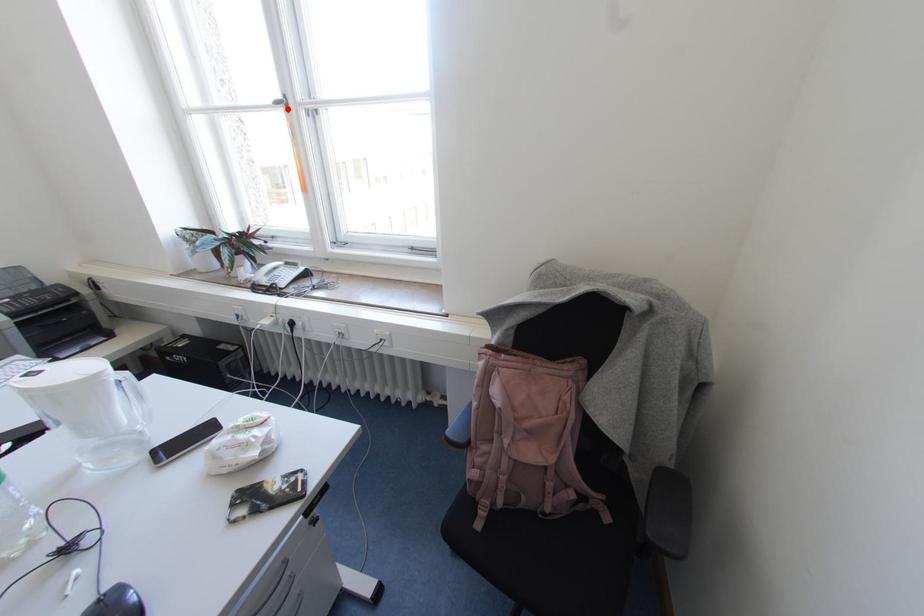
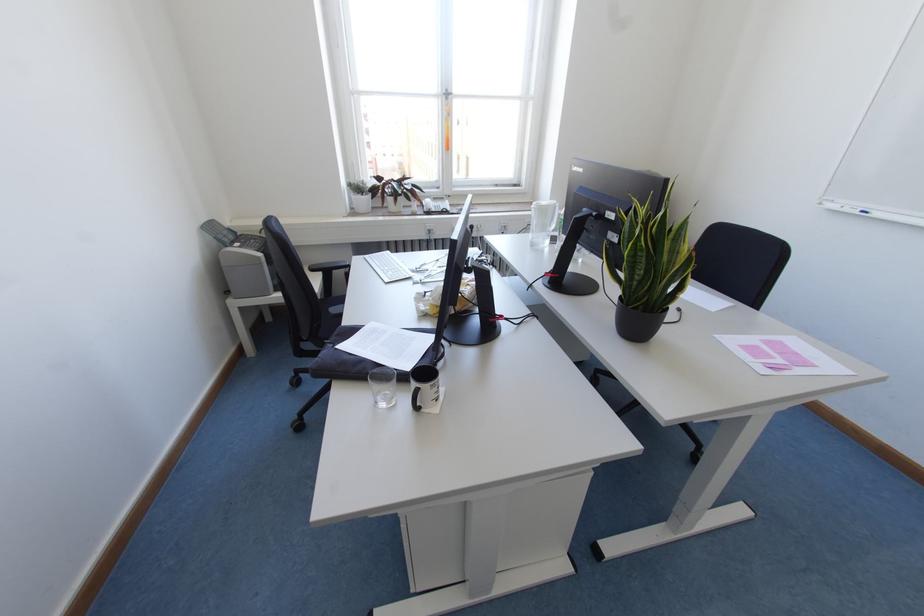
Find the pixel in the second image that matches the highlighted location in the first image.

(446, 98)